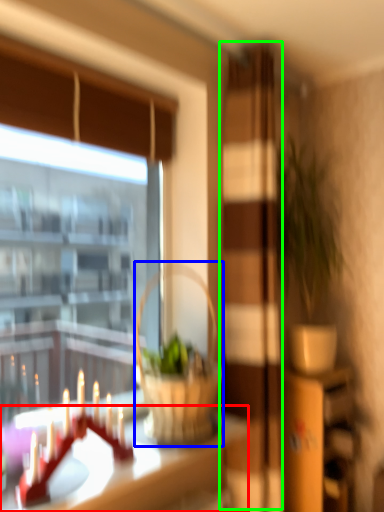
Question: Which is farther away from table (highlighted by a red box)? picnic basket (highlighted by a blue box) or screen door (highlighted by a green box)?

Choices:
 (A) picnic basket
 (B) screen door

Answer: (B)